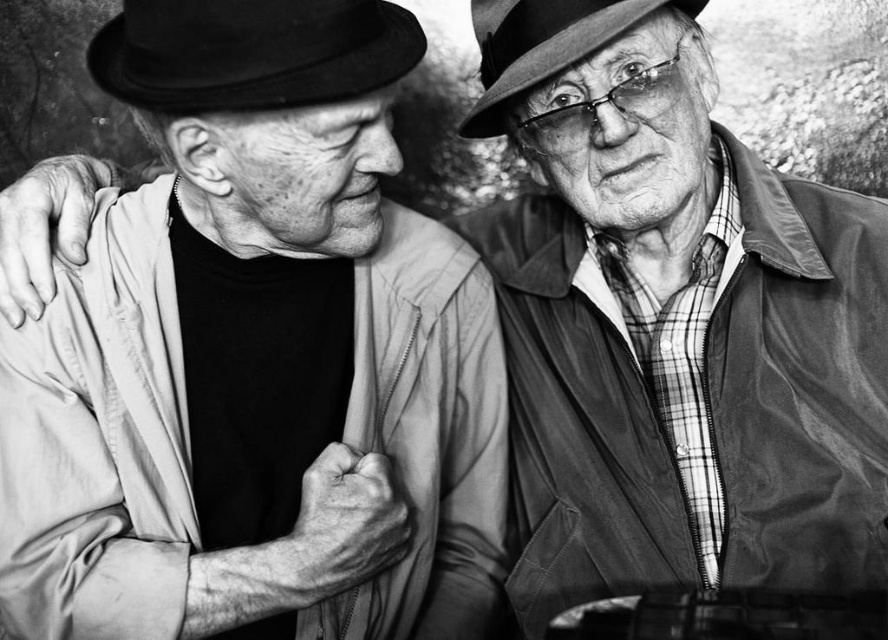
You are a photographer trying to adjust the focus of your camera. You have two points to consider for focusing, one of which is the point at coordinates point (256, 83). Since you want to focus on the closest object to the camera, which point should you choose?

The point at coordinates point (256, 83) is 36.14 inches away from the camera, so you should focus on this point as it is closer to the camera than the other point.

Based on the scene described, which object, the black felt fedora at upper left or the matte black hat at upper right, has a greater width?

The black felt fedora at upper left is wider than the matte black hat at upper right according to the description.

You are a photographer analyzing this image. You notice two points in the scene at coordinates point [244,83] and point [503,131]. Which of these points is nearer to the camera?

Point [244,83] is closer to the camera than point [503,131].